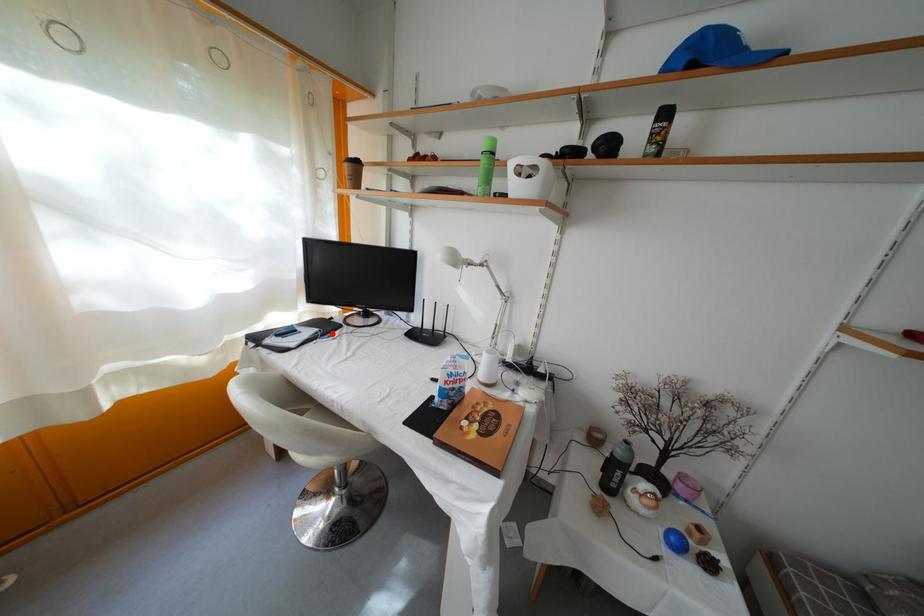
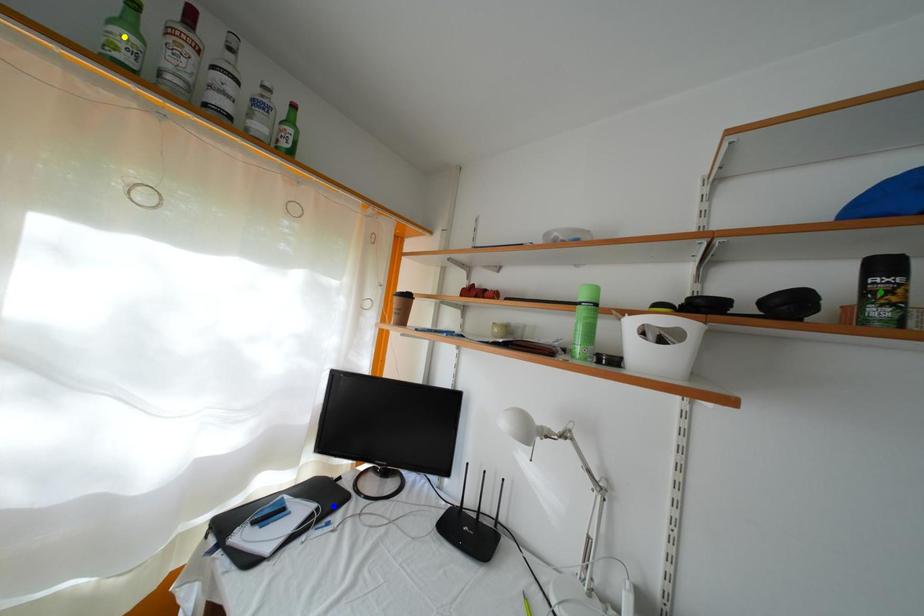
Question: I am providing you with two images of the same scene from different viewpoints. A red point is marked on the first image. You are given multiple points on the second image. Can you choose the point in image 2 that corresponds to the point in image 1?

Choices:
 (A) blue point
 (B) green point
 (C) yellow point

Answer: (A)